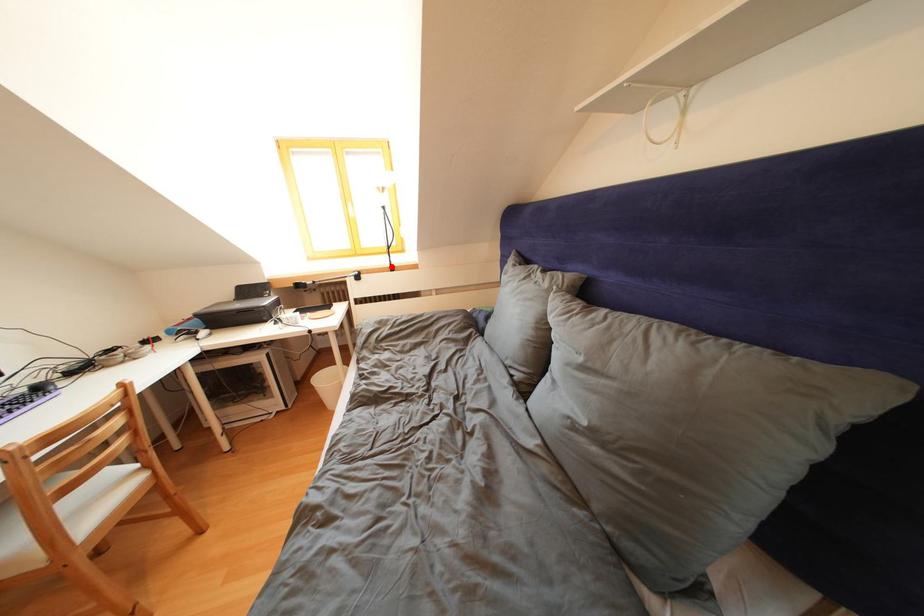
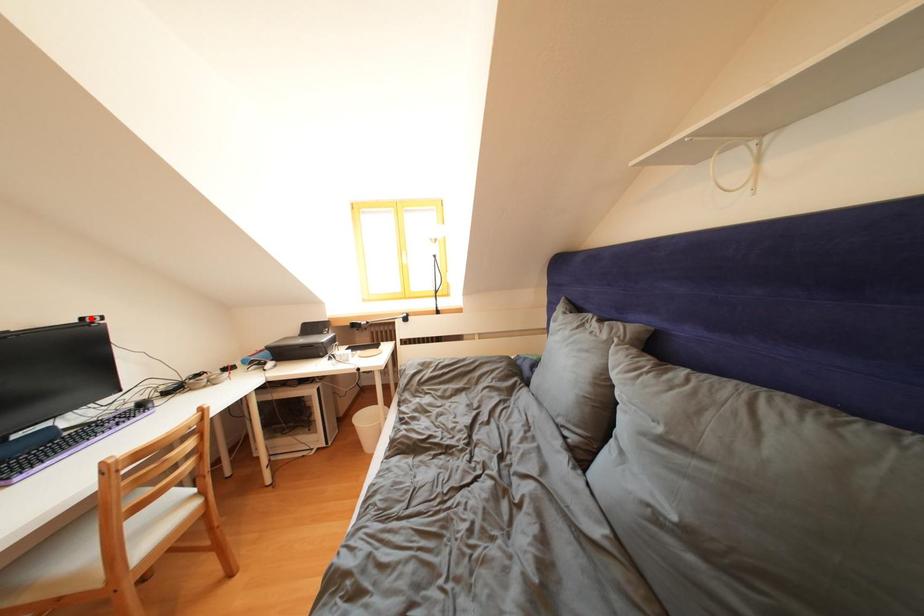
I am providing you with two images of the same scene from different viewpoints. A red point is marked on the first image and another point is marked on the second image. Is the marked point in image1 the same physical position as the marked point in image2?

No